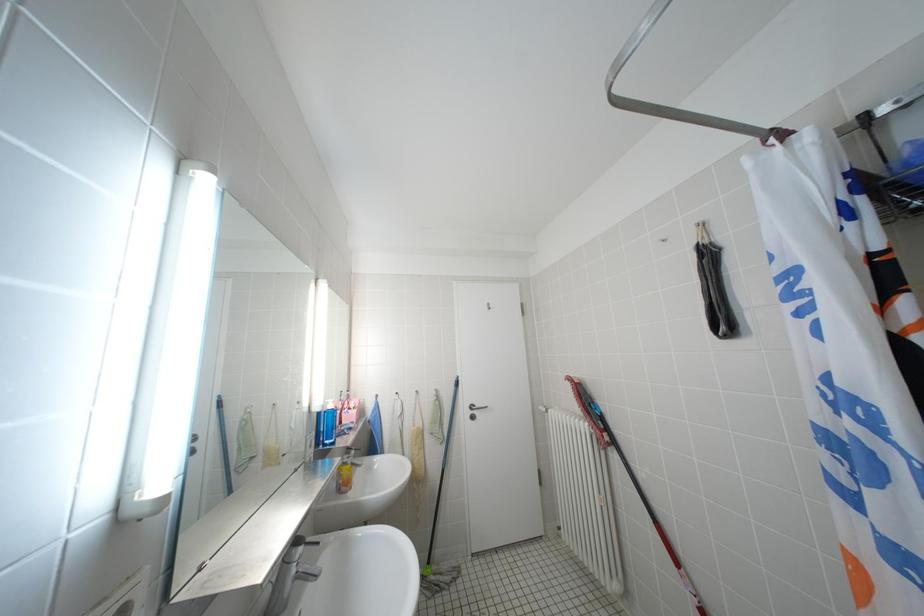
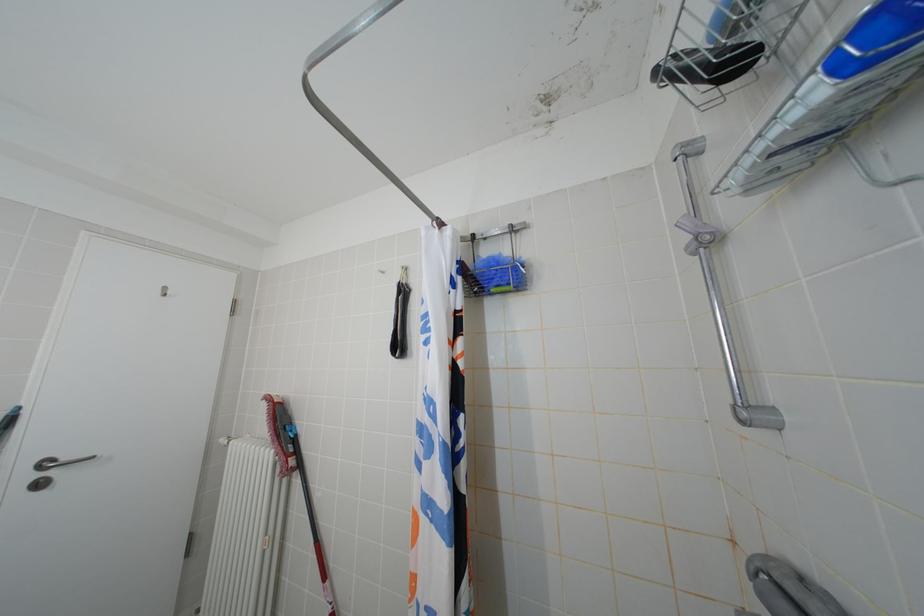
Question: The camera is either moving clockwise (left) or counter-clockwise (right) around the object. The first image is from the beginning of the video and the second image is from the end. Is the camera moving left or right when shooting the video?

Choices:
 (A) Left
 (B) Right

Answer: (A)